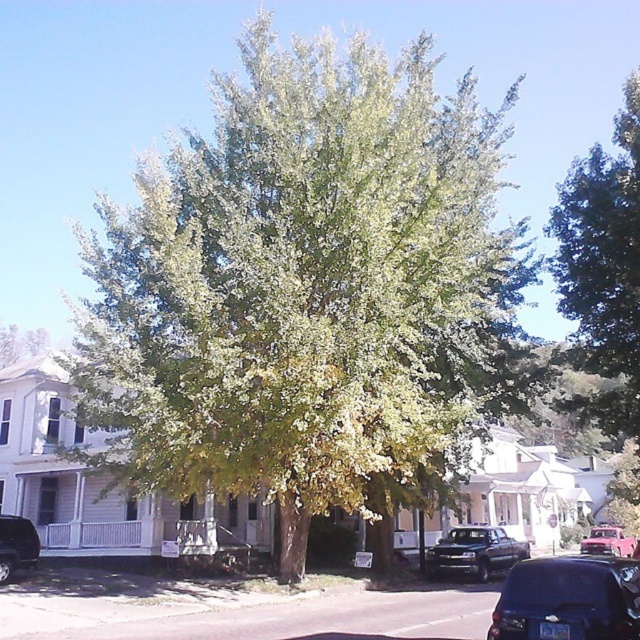
You are standing at the base of the large tree and want to take a photo of the houses in the background. However, the tree is blocking your view. Can you move to the point at coordinates point [474,552] to get a clearer view of the houses? Please explain your reasoning.

At point [474,552] lies metallic gray truck at center. Moving to that point would place you directly in front of the metallic gray truck at center, which may block your view of the houses behind it. Therefore, this position might not provide a clear view of the houses due to the truck obstruction.

You are standing in front of the large tree and want to walk towards the houses in the background. You notice two points marked on the ground ahead of you. The first point is at point (484,561) and the second is at point (596,548). Which point should you aim for if you want to reach the houses more quickly?

You should aim for point (484,561) because it is in front of point (596,548), meaning it is closer to the houses and will allow you to reach them more quickly.

You are a delivery driver who needs to park your metallic gray truck at center in a spot next to the green leafy tree at center. The parking spot is only wide enough for vehicles narrower than the tree. Can your truck fit?

The green leafy tree at center is wider than the metallic gray truck at center. Since the parking spot can accommodate vehicles narrower than the tree, the metallic gray truck at center can fit in the spot.